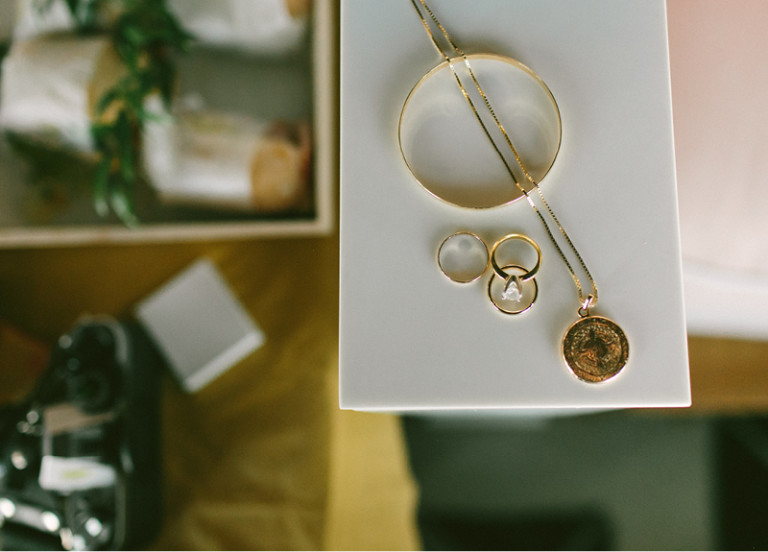
This screenshot has width=768, height=552. Find the location of `plant pot`. plant pot is located at coordinates (58, 95).